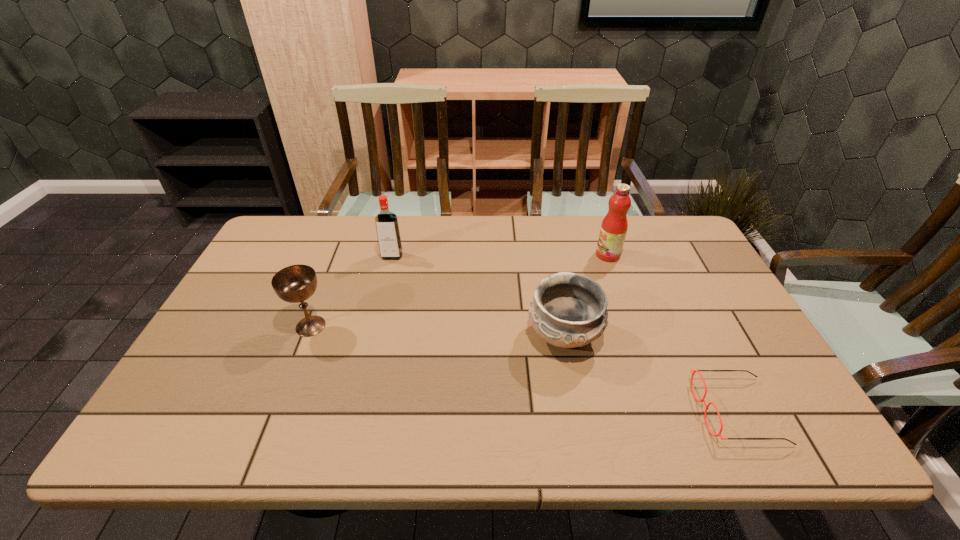
Locate an element on the screen. Image resolution: width=960 pixels, height=540 pixels. the second object from right to left is located at coordinates (614, 226).

I want to click on vodka, so click(388, 234).

At what (x,y) coordinates should I click in order to perform the action: click on chalice. Please return your answer as a coordinate pair (x, y). The height and width of the screenshot is (540, 960). Looking at the image, I should click on (296, 283).

Locate an element on the screen. This screenshot has height=540, width=960. the third object from right to left is located at coordinates [569, 310].

The width and height of the screenshot is (960, 540). I want to click on pottery, so click(569, 310).

The width and height of the screenshot is (960, 540). I want to click on the nearest object, so click(702, 400).

Image resolution: width=960 pixels, height=540 pixels. In order to click on the shortest object in this screenshot , I will do `click(702, 400)`.

Locate an element on the screen. This screenshot has height=540, width=960. vacant space located on the front label of the second object from right to left is located at coordinates (580, 255).

Locate an element on the screen. This screenshot has width=960, height=540. free point located on the front label of the second object from right to left is located at coordinates (555, 255).

What are the coordinates of `free space located on the front label of the second object from right to left` in the screenshot? It's located at (564, 255).